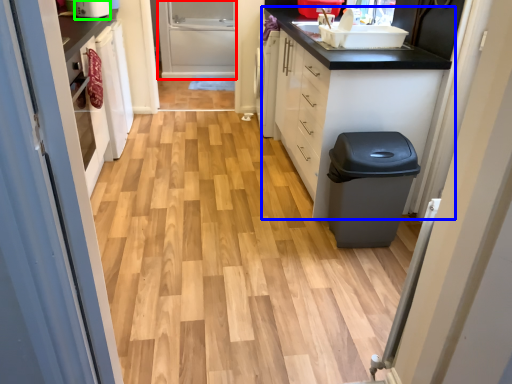
Question: Considering the real-world distances, which object is closest to screen door (highlighted by a red box)? cabinetry (highlighted by a blue box) or appliance (highlighted by a green box).

Choices:
 (A) cabinetry
 (B) appliance

Answer: (A)